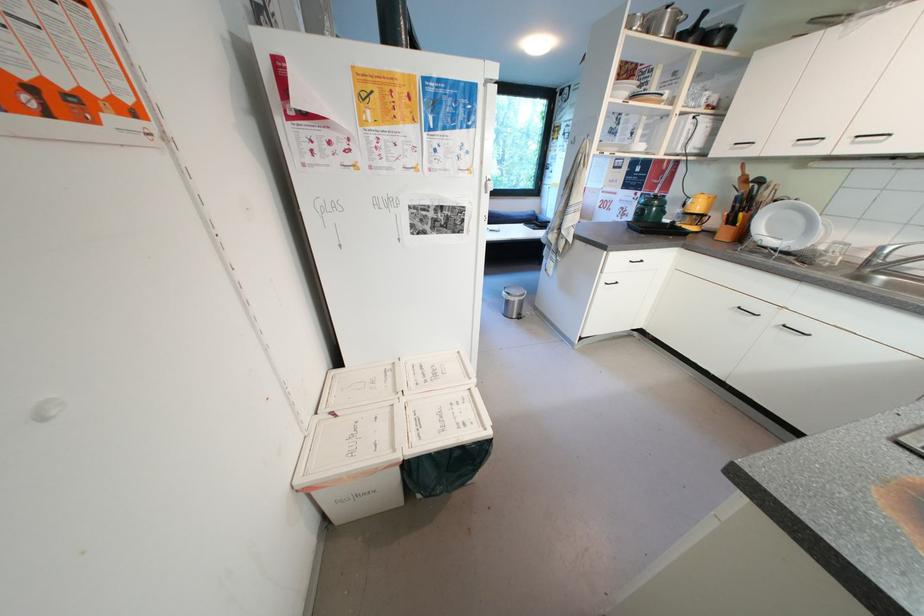
The width and height of the screenshot is (924, 616). Describe the element at coordinates (651, 200) in the screenshot. I see `the green pot lid` at that location.